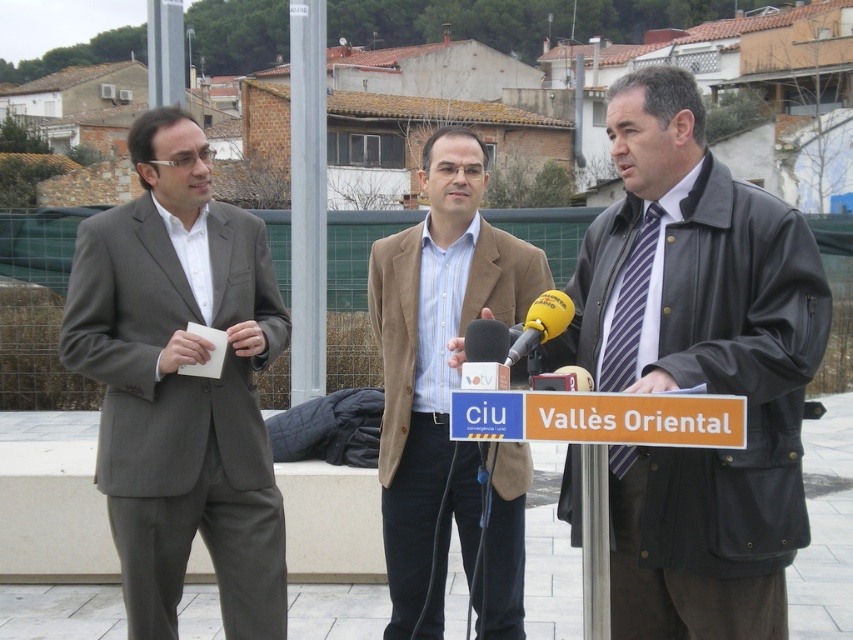
Between point (165, 157) and point (299, 310), which one is positioned in front?

Point (165, 157)

Can you confirm if matte gray suit at left is taller than metallic pole at center?

No.

Who is more distant from viewer, [77,284] or [311,275]?

Positioned behind is point [311,275].

Locate an element on the screen. This screenshot has height=640, width=853. matte gray suit at left is located at coordinates (181, 385).

Does matte gray suit at left appear under brown textured blazer at center?

Actually, matte gray suit at left is above brown textured blazer at center.

Is point (164, 132) closer to camera compared to point (426, 388)?

Yes.

Locate an element on the screen. The width and height of the screenshot is (853, 640). matte gray suit at left is located at coordinates (181, 385).

Measure the distance between brown textured blazer at center and camera.

The distance of brown textured blazer at center from camera is 11.90 feet.

Is brown textured blazer at center in front of metallic pole at center?

Yes, it is.

Does point (405, 563) lie in front of point (308, 321)?

Yes, it is.

Identify the location of brown textured blazer at center. (437, 365).